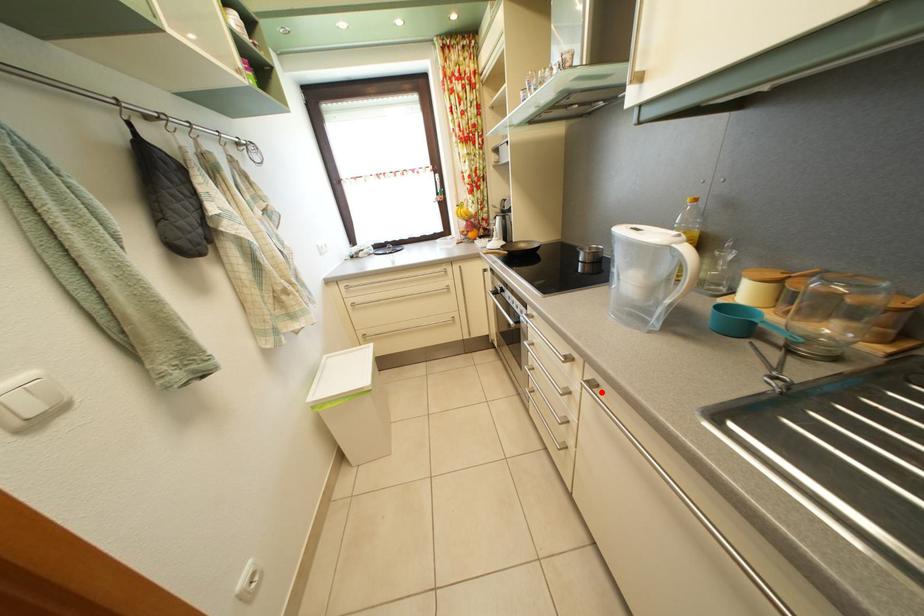
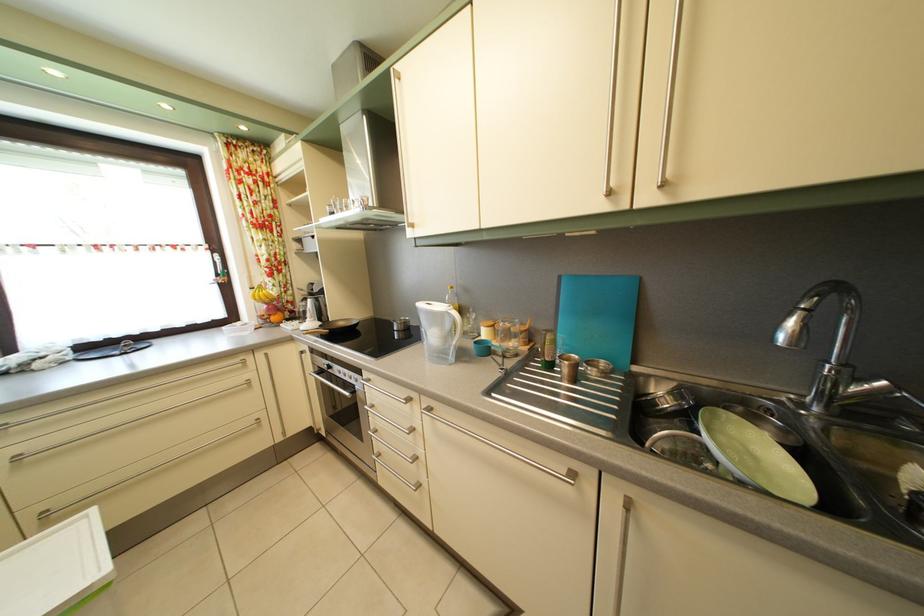
In the second image, find the point that corresponds to the highlighted location in the first image.

(438, 416)